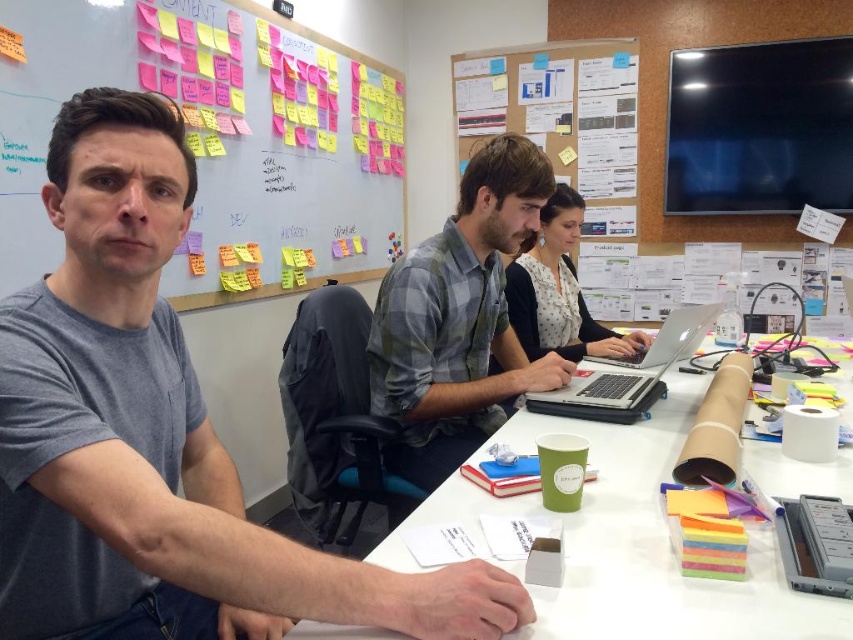
Consider the image. Can you confirm if multicolored sticky notes at upper left is positioned above plaid shirt at center?

Yes.

Does multicolored sticky notes at upper left have a lesser width compared to plaid shirt at center?

In fact, multicolored sticky notes at upper left might be wider than plaid shirt at center.

Find the location of a particular element. multicolored sticky notes at upper left is located at coordinates (218, 140).

The height and width of the screenshot is (640, 853). In order to click on multicolored sticky notes at upper left in this screenshot , I will do `click(218, 140)`.

Measure the distance from gray cotton t-shirt at left to white paper at center.

The distance of gray cotton t-shirt at left from white paper at center is 17.04 inches.

Is gray cotton t-shirt at left bigger than white paper at center?

Incorrect, gray cotton t-shirt at left is not larger than white paper at center.

Does point (177, 371) come closer to viewer compared to point (804, 637)?

No, (177, 371) is further to viewer.

The image size is (853, 640). I want to click on gray cotton t-shirt at left, so pos(155,435).

Who is higher up, gray cotton t-shirt at left or multicolored sticky notes at upper left?

multicolored sticky notes at upper left

Consider the image. Can you confirm if gray cotton t-shirt at left is positioned to the left of multicolored sticky notes at upper left?

No, gray cotton t-shirt at left is not to the left of multicolored sticky notes at upper left.

Is point (199, 548) positioned in front of point (354, 273)?

Yes, point (199, 548) is in front of point (354, 273).

Where is `gray cotton t-shirt at left`? gray cotton t-shirt at left is located at coordinates (155, 435).